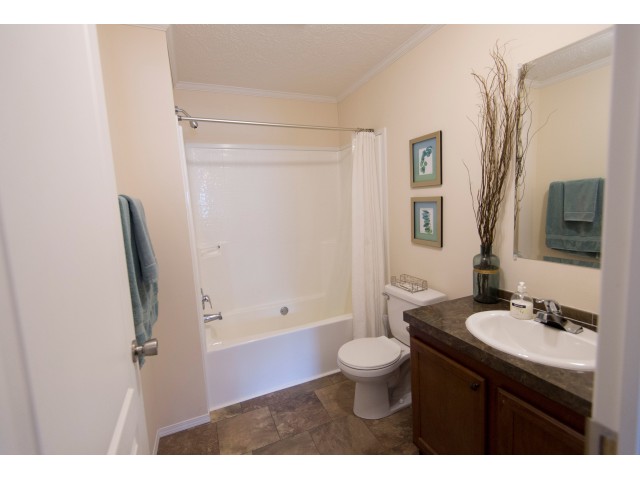
This screenshot has height=480, width=640. What are the coordinates of `towels` in the screenshot? It's located at (147, 253), (139, 275), (580, 201), (580, 227).